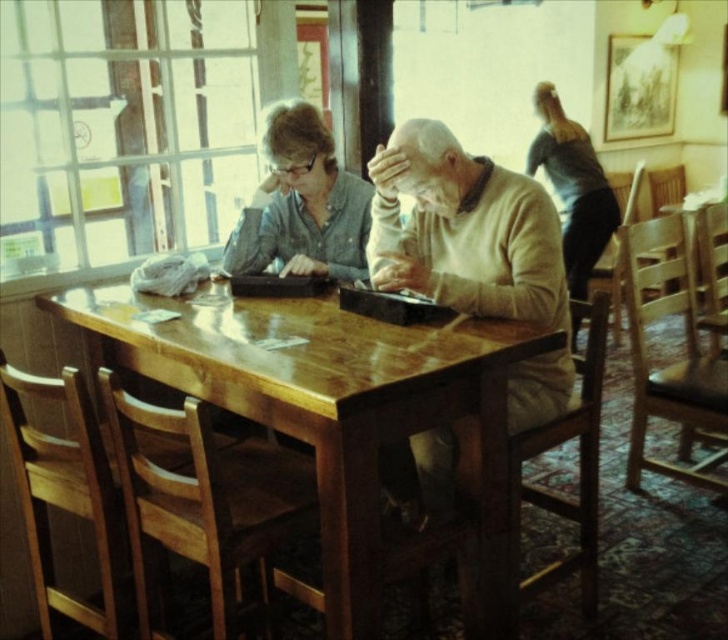
Question: Among these objects, which one is farthest from the camera?

Choices:
 (A) matte gray sweater at center
 (B) light beige sweater at center
 (C) dark gray sweater at upper right
 (D) glossy wood table at center

Answer: (C)

Question: Can you confirm if light beige sweater at center is bigger than matte gray sweater at center?

Choices:
 (A) no
 (B) yes

Answer: (B)

Question: Which point appears closest to the camera in this image?

Choices:
 (A) (574, 316)
 (B) (332, 234)
 (C) (466, 248)
 (D) (317, 314)

Answer: (D)

Question: Considering the real-world distances, which object is farthest from the matte gray sweater at center?

Choices:
 (A) dark gray sweater at upper right
 (B) light beige sweater at center

Answer: (A)

Question: Can you confirm if light beige sweater at center is bigger than matte gray sweater at center?

Choices:
 (A) no
 (B) yes

Answer: (B)

Question: Can you confirm if glossy wood table at center is positioned to the left of light beige sweater at center?

Choices:
 (A) yes
 (B) no

Answer: (A)